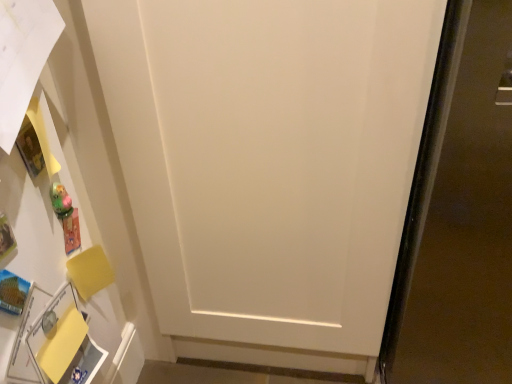
From the picture: Measure the distance between shiny plastic toy at left and camera.

shiny plastic toy at left and camera are 28.08 inches apart.

This screenshot has width=512, height=384. What are the coordinates of `shiny plastic toy at left` in the screenshot? It's located at (66, 216).

Describe the element at coordinates (66, 216) in the screenshot. I see `shiny plastic toy at left` at that location.

Where is `shiny plastic toy at left`? The width and height of the screenshot is (512, 384). shiny plastic toy at left is located at coordinates (66, 216).